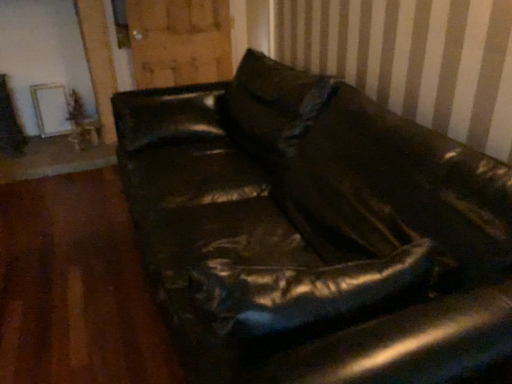
Question: Would you say leather couch at center is outside wooden table at lower left?

Choices:
 (A) yes
 (B) no

Answer: (A)

Question: From a real-world perspective, is leather couch at center below wooden table at lower left?

Choices:
 (A) no
 (B) yes

Answer: (A)

Question: Can wooden table at lower left be found inside leather couch at center?

Choices:
 (A) no
 (B) yes

Answer: (A)

Question: Is leather couch at center beside wooden table at lower left?

Choices:
 (A) yes
 (B) no

Answer: (B)

Question: Is leather couch at center turned away from wooden table at lower left?

Choices:
 (A) no
 (B) yes

Answer: (A)

Question: Considering the positions of point pos(267,114) and point pos(94,129), is point pos(267,114) closer or farther from the camera than point pos(94,129)?

Choices:
 (A) closer
 (B) farther

Answer: (A)

Question: In the image, is leather couch at center on the left side or the right side of wooden table at lower left?

Choices:
 (A) right
 (B) left

Answer: (A)

Question: Which is correct: leather couch at center is inside wooden table at lower left, or outside of it?

Choices:
 (A) outside
 (B) inside

Answer: (A)

Question: In terms of width, does leather couch at center look wider or thinner when compared to wooden table at lower left?

Choices:
 (A) thin
 (B) wide

Answer: (B)

Question: Considering the positions of leather couch at center and wooden at upper center in the image, is leather couch at center wider or thinner than wooden at upper center?

Choices:
 (A) thin
 (B) wide

Answer: (B)

Question: From a real-world perspective, is leather couch at center positioned above or below wooden at upper center?

Choices:
 (A) above
 (B) below

Answer: (B)

Question: Does point (407, 139) appear closer or farther from the camera than point (184, 11)?

Choices:
 (A) farther
 (B) closer

Answer: (B)

Question: Is leather couch at center spatially inside wooden at upper center, or outside of it?

Choices:
 (A) inside
 (B) outside

Answer: (B)

Question: Is wooden at upper center in front of or behind wooden table at lower left in the image?

Choices:
 (A) behind
 (B) front

Answer: (B)

Question: From the image's perspective, is wooden at upper center located above or below wooden table at lower left?

Choices:
 (A) below
 (B) above

Answer: (B)